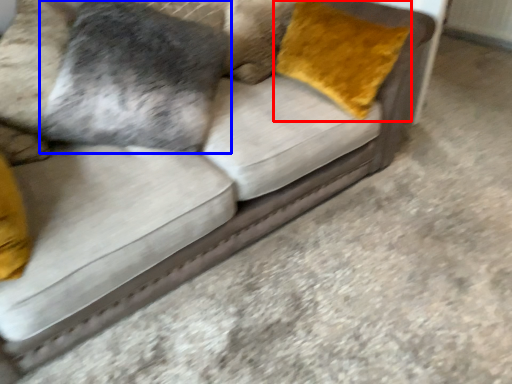
Question: Among these objects, which one is nearest to the camera, throw pillow (highlighted by a red box) or pillow (highlighted by a blue box)?

Choices:
 (A) throw pillow
 (B) pillow

Answer: (A)